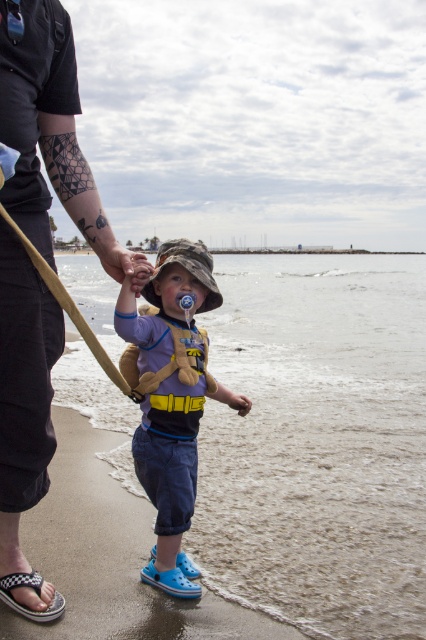
Can you confirm if matte blue shorts at center is smaller than checkerboard fabric sandal at lower left?

No.

Between matte blue shorts at center and checkerboard fabric sandal at lower left, which one appears on the left side from the viewer's perspective?

checkerboard fabric sandal at lower left is more to the left.

Which is behind, point (187, 476) or point (29, 614)?

The point (187, 476) is more distant.

Locate an element on the screen. The image size is (426, 640). matte blue shorts at center is located at coordinates (172, 397).

Consider the image. Is dark blue jeans at center shorter than checkerboard fabric sandal at lower left?

No.

This screenshot has height=640, width=426. I want to click on dark blue jeans at center, so click(48, 131).

Is dark blue jeans at center above matte blue shorts at center?

Yes, dark blue jeans at center is above matte blue shorts at center.

Describe the element at coordinates (48, 131) in the screenshot. Image resolution: width=426 pixels, height=640 pixels. I see `dark blue jeans at center` at that location.

I want to click on dark blue jeans at center, so click(x=48, y=131).

At what (x,y) coordinates should I click in order to perform the action: click on dark blue jeans at center. Please return your answer as a coordinate pair (x, y). This screenshot has width=426, height=640. Looking at the image, I should click on (48, 131).